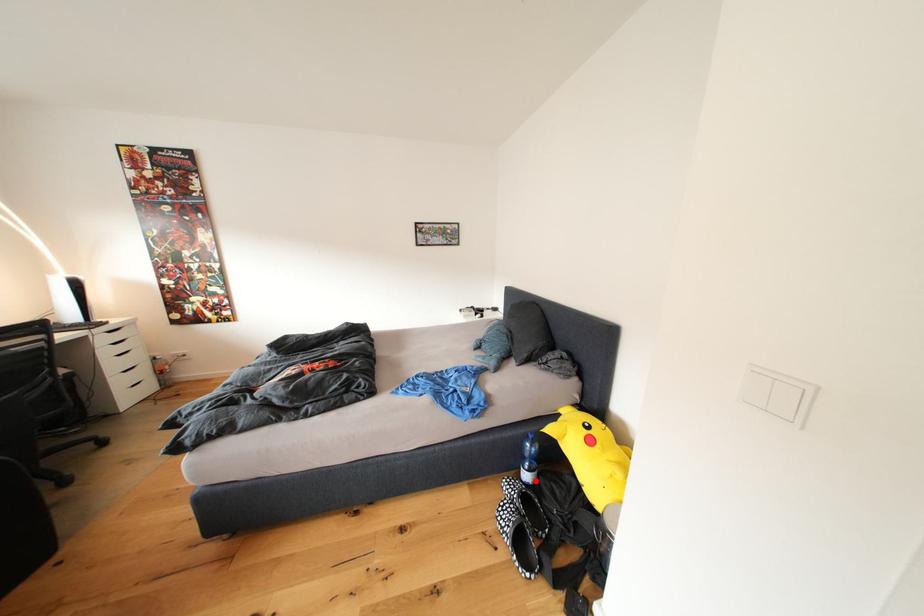
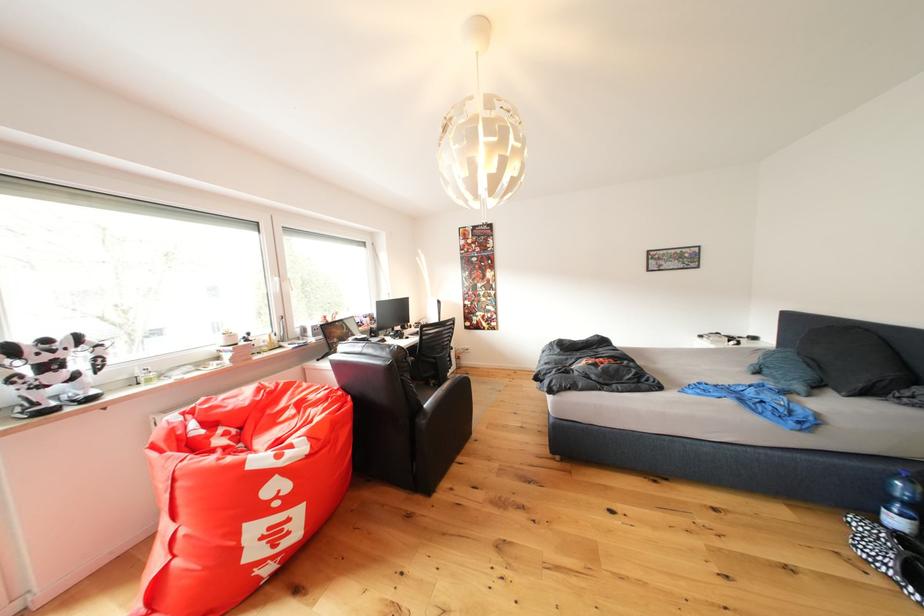
Find the pixel in the second image that matches the highlighted location in the first image.

(906, 527)